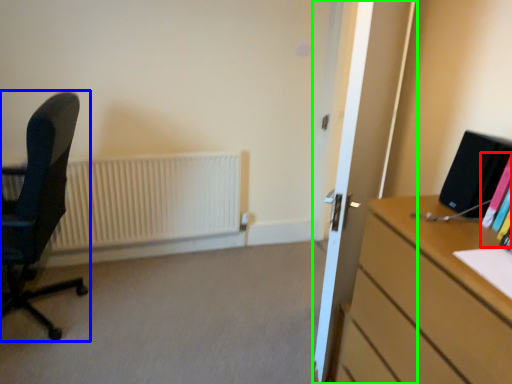
Question: Based on their relative distances, which object is nearer to book (highlighted by a red box)? Choose from chair (highlighted by a blue box) and glass door (highlighted by a green box).

Choices:
 (A) chair
 (B) glass door

Answer: (B)